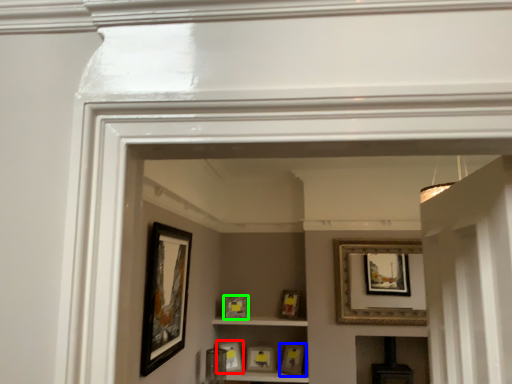
Question: Based on their relative distances, which object is farther from picture frame (highlighted by a red box)? Choose from picture frame (highlighted by a blue box) and picture frame (highlighted by a green box).

Choices:
 (A) picture frame
 (B) picture frame

Answer: (A)